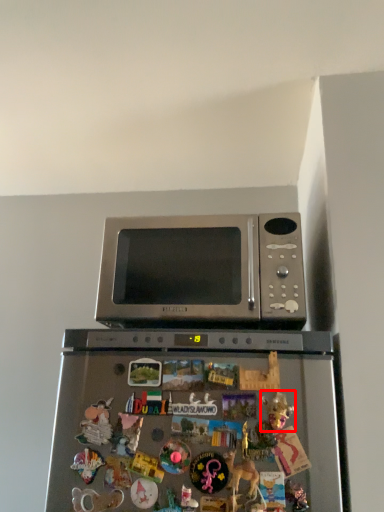
Question: Where is toy (annotated by the red box) located in relation to microwave oven in the image?

Choices:
 (A) left
 (B) right

Answer: (B)